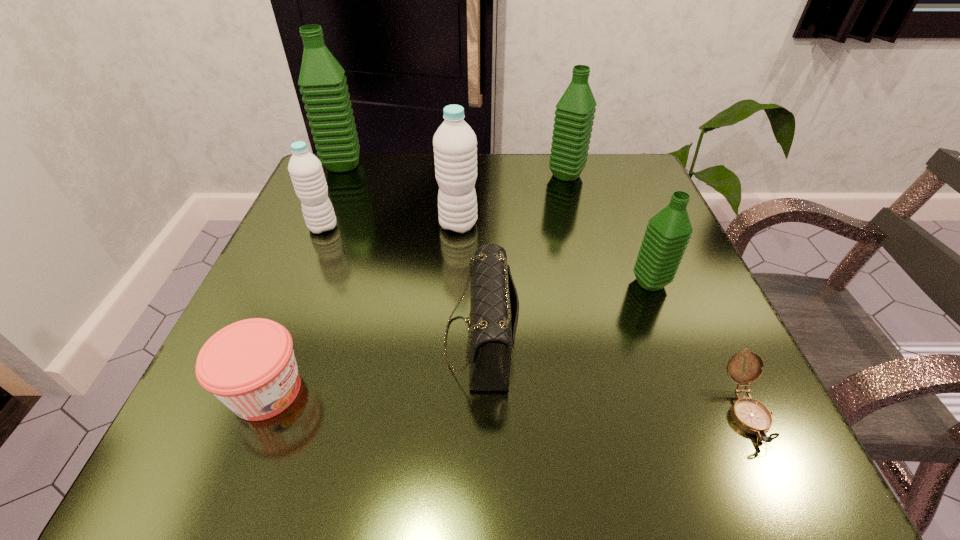
The image size is (960, 540). Find the location of `the biggest green water bottle`. the biggest green water bottle is located at coordinates (325, 93).

Identify the location of the tallest object. The height and width of the screenshot is (540, 960). (325, 93).

Image resolution: width=960 pixels, height=540 pixels. Find the location of `the second water bottle from right to left`. the second water bottle from right to left is located at coordinates (575, 110).

This screenshot has height=540, width=960. Find the location of `the second smallest green water bottle`. the second smallest green water bottle is located at coordinates [x=575, y=110].

At what (x,y) coordinates should I click in order to perform the action: click on the right white water bottle. Please return your answer as a coordinate pair (x, y). Looking at the image, I should click on (455, 145).

Identify the location of the third water bottle from right to left. (455, 145).

This screenshot has width=960, height=540. Identify the location of the left white water bottle. (306, 172).

Locate an element on the screen. the nearest water bottle is located at coordinates click(668, 232).

Where is `the second object from right to left`? the second object from right to left is located at coordinates (668, 232).

The height and width of the screenshot is (540, 960). I want to click on clutch bag, so click(x=494, y=308).